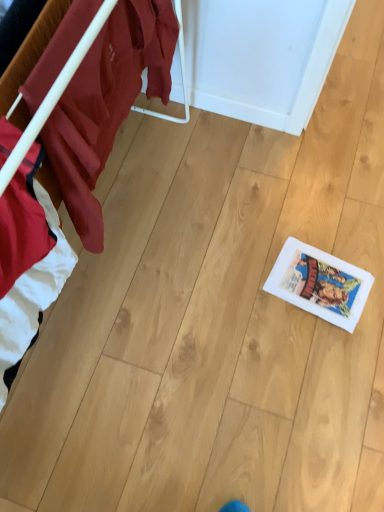
This screenshot has width=384, height=512. Describe the element at coordinates (319, 283) in the screenshot. I see `white paper comic book at lower right` at that location.

Where is `white paper comic book at lower right`? Image resolution: width=384 pixels, height=512 pixels. white paper comic book at lower right is located at coordinates (319, 283).

I want to click on wooden floor at lower right, so click(32, 294).

This screenshot has height=512, width=384. What do you see at coordinates (32, 294) in the screenshot? I see `wooden floor at lower right` at bounding box center [32, 294].

Find the location of a particular element. This screenshot has height=512, width=384. white paper comic book at lower right is located at coordinates tap(319, 283).

Is wooden floor at lower right to the left of white paper comic book at lower right from the viewer's perspective?

Yes.

Relative to white paper comic book at lower right, is wooden floor at lower right in front or behind?

Clearly, wooden floor at lower right is in front of white paper comic book at lower right.

Does point (61, 276) come farther from viewer compared to point (331, 300)?

No, (61, 276) is closer to viewer.

From the image's perspective, between wooden floor at lower right and white paper comic book at lower right, which one is located above?

wooden floor at lower right.

From a real-world perspective, which is physically below, wooden floor at lower right or white paper comic book at lower right?

white paper comic book at lower right is physically lower.

Which of these two, wooden floor at lower right or white paper comic book at lower right, is wider?

Wider between the two is white paper comic book at lower right.

Is wooden floor at lower right taller or shorter than white paper comic book at lower right?

wooden floor at lower right is taller than white paper comic book at lower right.

Who is bigger, wooden floor at lower right or white paper comic book at lower right?

Bigger between the two is wooden floor at lower right.

Would you say white paper comic book at lower right is part of wooden floor at lower right's contents?

Definitely not — white paper comic book at lower right is not inside wooden floor at lower right.

Can you see wooden floor at lower right touching white paper comic book at lower right?

No, wooden floor at lower right is not with white paper comic book at lower right.

Is wooden floor at lower right facing towards white paper comic book at lower right?

No, wooden floor at lower right does not turn towards white paper comic book at lower right.

How different are the orientations of wooden floor at lower right and white paper comic book at lower right in degrees?

They differ by 102 degrees in their facing directions.

Find the location of a particular element. The height and width of the screenshot is (512, 384). furniture in front of the white paper comic book at lower right is located at coordinates (32, 294).

Which object is positioned more to the left, white paper comic book at lower right or wooden floor at lower right?

From the viewer's perspective, wooden floor at lower right appears more on the left side.

Which object is more forward, white paper comic book at lower right or wooden floor at lower right?

wooden floor at lower right is more forward.

Which point is more forward, (349,267) or (17,350)?

Positioned in front is point (17,350).

From the image's perspective, which is above, white paper comic book at lower right or wooden floor at lower right?

From the image's view, wooden floor at lower right is above.

From a real-world perspective, is white paper comic book at lower right located higher than wooden floor at lower right?

No, from a real-world perspective, white paper comic book at lower right is not over wooden floor at lower right

Is white paper comic book at lower right thinner than wooden floor at lower right?

No.

Can you confirm if white paper comic book at lower right is shorter than wooden floor at lower right?

Yes.

Who is bigger, white paper comic book at lower right or wooden floor at lower right?

With larger size is wooden floor at lower right.

Would you say white paper comic book at lower right contains wooden floor at lower right?

No, wooden floor at lower right is not surrounded by white paper comic book at lower right.

Is white paper comic book at lower right placed right next to wooden floor at lower right?

No.

Is white paper comic book at lower right oriented away from wooden floor at lower right?

No.

Can you tell me how much white paper comic book at lower right and wooden floor at lower right differ in facing direction?

They differ by 102 degrees in their facing directions.

You are a GUI agent. You are given a task and a screenshot of the screen. Output one action in this format:
    pyautogui.click(x=<x>, y=<y>)
    Task: Click on the furniture on the left of white paper comic book at lower right
    
    Given the screenshot: What is the action you would take?
    pyautogui.click(x=32, y=294)

Where is `furniture on the left of white paper comic book at lower right`? This screenshot has height=512, width=384. furniture on the left of white paper comic book at lower right is located at coordinates (x=32, y=294).

Where is `comic book behind the wooden floor at lower right`? This screenshot has width=384, height=512. comic book behind the wooden floor at lower right is located at coordinates (319, 283).